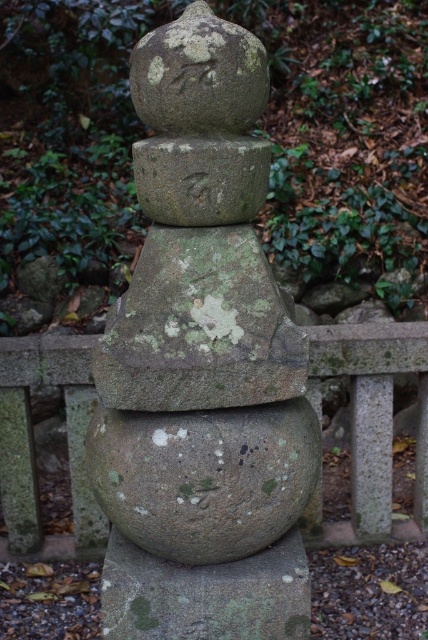
Question: Which of the following is the farthest from the observer?

Choices:
 (A) (184, 154)
 (B) (269, 561)
 (C) (79, 371)

Answer: (C)

Question: Which of the following is the closest to the observer?

Choices:
 (A) (246, 586)
 (B) (354, 340)
 (C) (95, 493)

Answer: (A)

Question: Which point appears closest to the camera in this image?

Choices:
 (A) (258, 630)
 (B) (317, 544)

Answer: (A)

Question: Can you confirm if gray stone statue at center is smaller than green mossy stone at center?

Choices:
 (A) yes
 (B) no

Answer: (B)

Question: Does gray stone statue at center appear under green mossy stone at center?

Choices:
 (A) no
 (B) yes

Answer: (A)

Question: Does gray stone statue at center appear on the right side of gray stone fence at center?

Choices:
 (A) yes
 (B) no

Answer: (B)